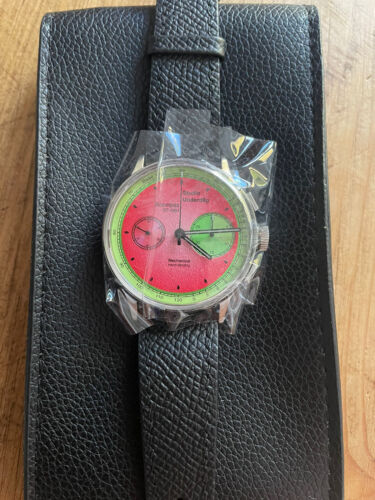
The width and height of the screenshot is (375, 500). I want to click on table, so click(354, 465).